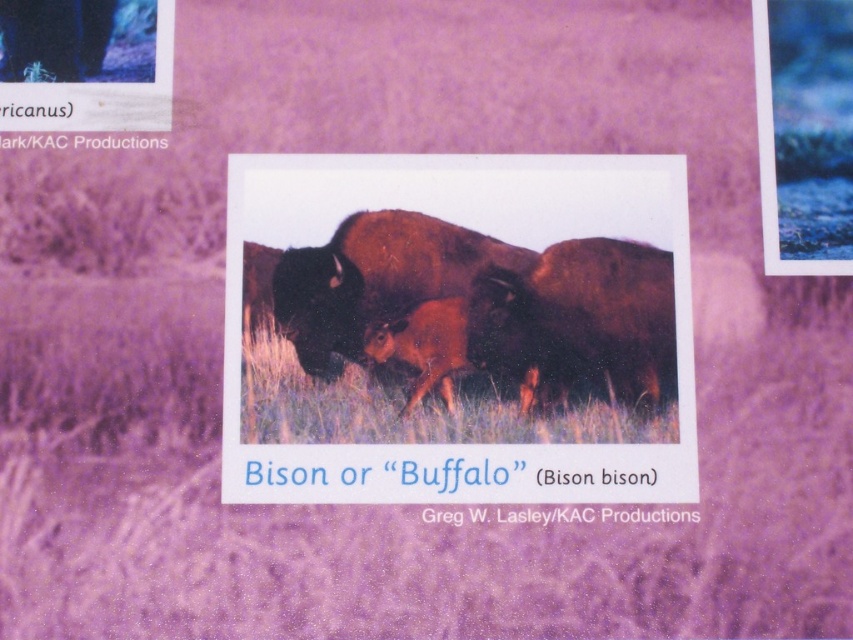
Question: Is brown fur bison at center wider than brown fuzzy bison at center?

Choices:
 (A) yes
 (B) no

Answer: (A)

Question: Does brown fur bison at center have a lesser width compared to brown fuzzy bison at center?

Choices:
 (A) yes
 (B) no

Answer: (B)

Question: Among these objects, which one is nearest to the camera?

Choices:
 (A) brown fur bison at center
 (B) brown fuzzy bison at center

Answer: (A)

Question: Which point appears farthest from the camera in this image?

Choices:
 (A) (229, 209)
 (B) (404, 248)

Answer: (B)

Question: Does brown fur bison at center lie in front of brown fuzzy bison at center?

Choices:
 (A) no
 (B) yes

Answer: (B)